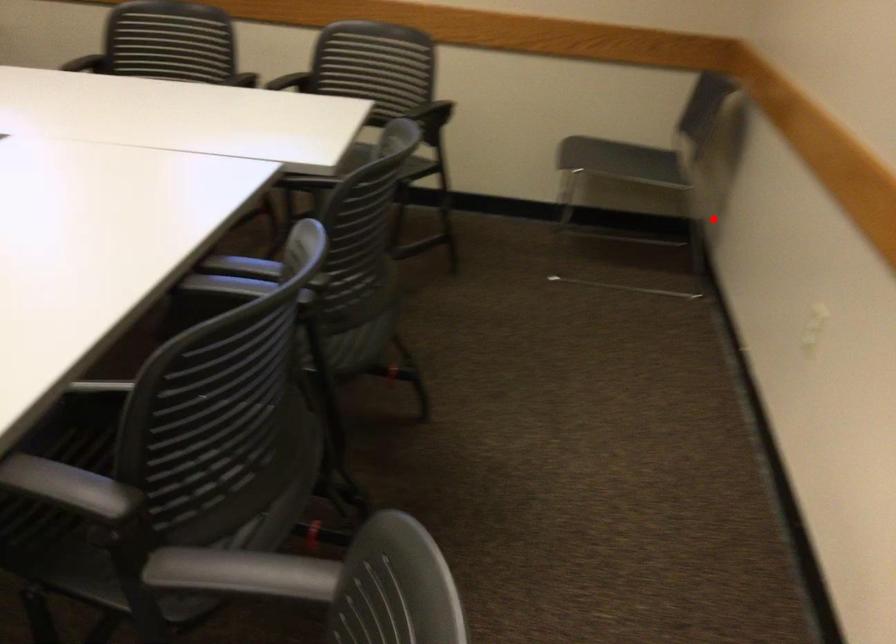
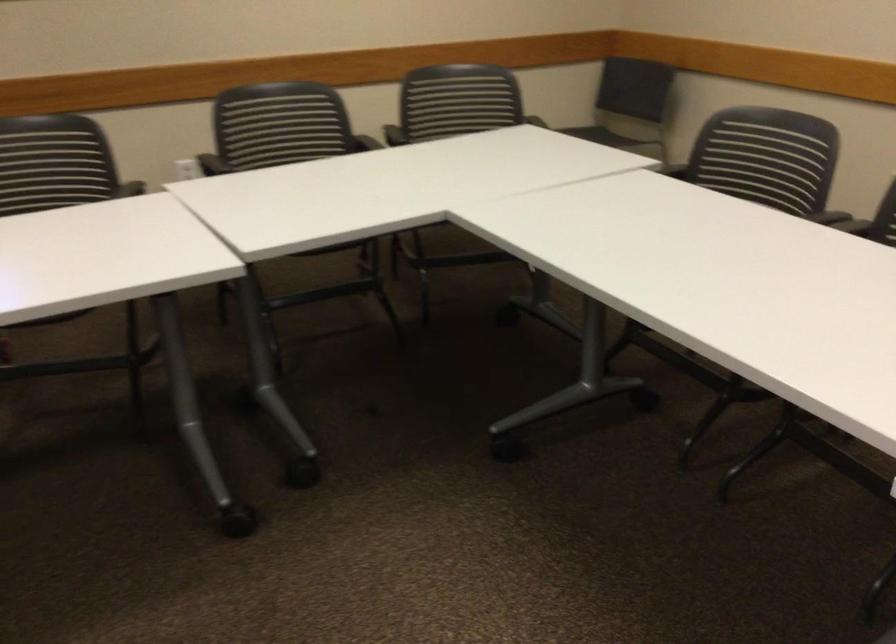
Question: I am providing you with two images of the same scene from different viewpoints. Image1 has a red point marked. In image2, the corresponding 3D location appears at what relative position? Reply with the corresponding letter.

Choices:
 (A) Closer
 (B) Farther

Answer: (B)